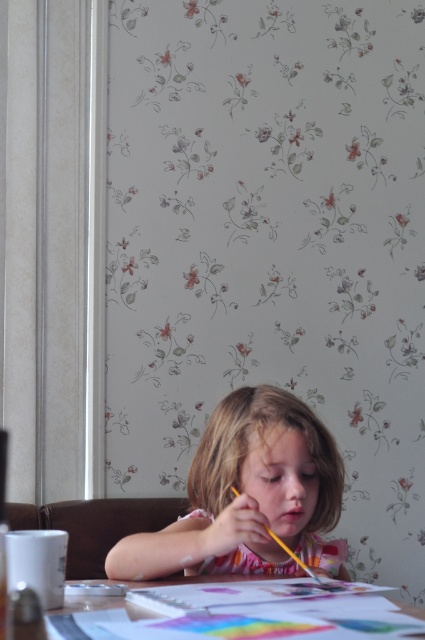
Who is positioned more to the left, smooth pink dress at center or yellow matte crayon at center?

From the viewer's perspective, smooth pink dress at center appears more on the left side.

Is point (186, 564) positioned in front of point (234, 492)?

Yes, point (186, 564) is in front of point (234, 492).

Who is more distant from viewer, (207, 422) or (277, 544)?

The point (207, 422) is behind.

Identify the location of smooth pink dress at center. Image resolution: width=425 pixels, height=640 pixels. (246, 493).

Can you confirm if smooth pink dress at center is smaller than smooth paper at lower center?

No.

You are a GUI agent. You are given a task and a screenshot of the screen. Output one action in this format:
    pyautogui.click(x=<x>, y=<y>)
    Task: Click on the smooth pink dress at center
    The height and width of the screenshot is (640, 425).
    Given the screenshot: What is the action you would take?
    pyautogui.click(x=246, y=493)

Find the location of a particular element. Image resolution: width=425 pixels, height=640 pixels. smooth pink dress at center is located at coordinates (246, 493).

Does smooth paper at lower center have a greater width compared to yellow matte crayon at center?

Yes.

Is smooth paper at lower center below yellow matte crayon at center?

Yes.

Looking at this image, who is more forward, (x=320, y=604) or (x=312, y=572)?

Point (x=320, y=604) is more forward.

The height and width of the screenshot is (640, 425). Find the location of `smooth paper at lower center`. smooth paper at lower center is located at coordinates (246, 612).